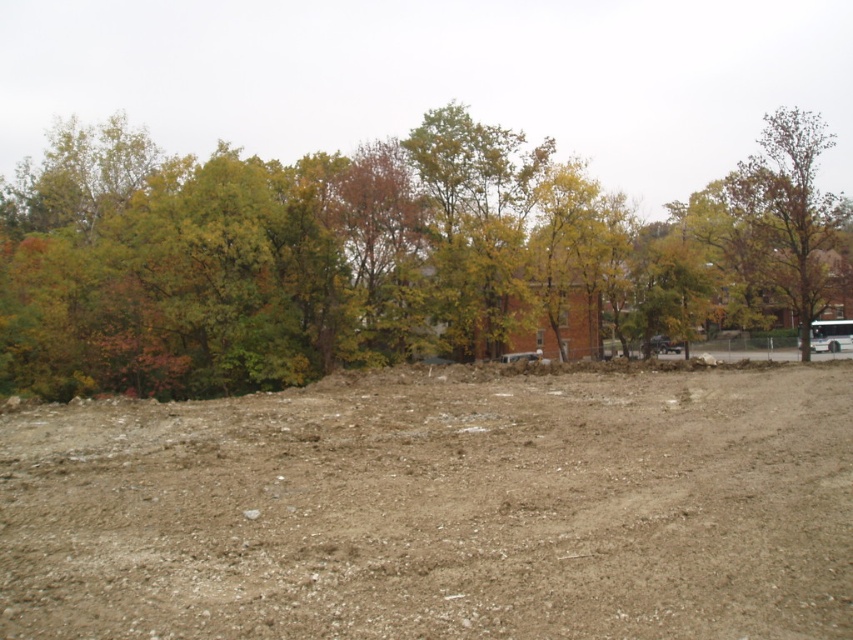
I want to click on green leafy tree at upper left, so click(386, 257).

Can you confirm if green leafy tree at upper left is positioned to the left of brown textured tree at upper right?

Correct, you'll find green leafy tree at upper left to the left of brown textured tree at upper right.

Locate an element on the screen. The image size is (853, 640). green leafy tree at upper left is located at coordinates (386, 257).

You are a GUI agent. You are given a task and a screenshot of the screen. Output one action in this format:
    pyautogui.click(x=<x>, y=<y>)
    Task: Click on the green leafy tree at upper left
    The image size is (853, 640).
    Given the screenshot: What is the action you would take?
    pyautogui.click(x=386, y=257)

Does brown sandy dirt at center have a lesser height compared to green leafy tree at upper left?

Yes.

Between brown sandy dirt at center and green leafy tree at upper left, which one has more height?

Standing taller between the two is green leafy tree at upper left.

This screenshot has width=853, height=640. Describe the element at coordinates (438, 508) in the screenshot. I see `brown sandy dirt at center` at that location.

Where is `brown sandy dirt at center`? This screenshot has width=853, height=640. brown sandy dirt at center is located at coordinates (438, 508).

Who is shorter, brown sandy dirt at center or brown textured tree at upper right?

brown sandy dirt at center

Can you confirm if brown sandy dirt at center is positioned to the left of brown textured tree at upper right?

Indeed, brown sandy dirt at center is positioned on the left side of brown textured tree at upper right.

Describe the element at coordinates (438, 508) in the screenshot. I see `brown sandy dirt at center` at that location.

The height and width of the screenshot is (640, 853). I want to click on brown sandy dirt at center, so click(438, 508).